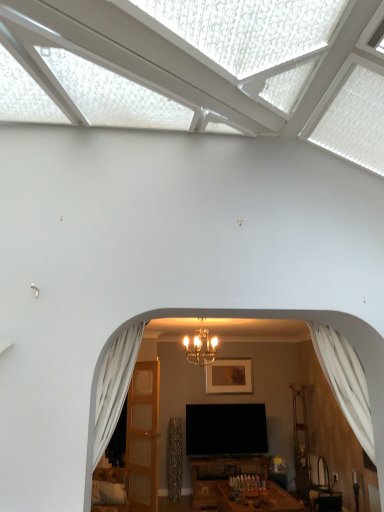
Question: From the image's perspective, relative to light brown wooden door at center, is matte gold picture frame at center above or below?

Choices:
 (A) below
 (B) above

Answer: (B)

Question: Based on their sizes in the image, would you say matte gold picture frame at center is bigger or smaller than light brown wooden door at center?

Choices:
 (A) small
 (B) big

Answer: (A)

Question: Considering the real-world distances, which object is farthest from the white sheer curtain at right, the first curtain viewed from the right?

Choices:
 (A) light brown wooden door at center
 (B) white sheer curtain at left, positioned as the 1th curtain in left-to-right order
 (C) metallic chandelier at center
 (D) matte gold picture frame at center

Answer: (A)

Question: Which is farther from the matte gold picture frame at center?

Choices:
 (A) white sheer curtain at left, arranged as the second curtain when viewed from the right
 (B) white sheer curtain at right, placed as the 2th curtain when sorted from left to right
 (C) light brown wooden door at center
 (D) metallic chandelier at center

Answer: (B)